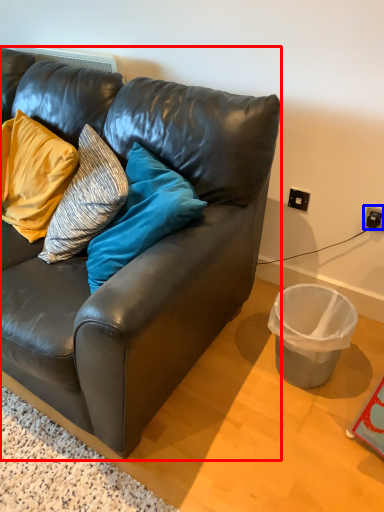
Question: Which of the following is the closest to the observer, studio couch (highlighted by a red box) or power outlet (highlighted by a blue box)?

Choices:
 (A) studio couch
 (B) power outlet

Answer: (A)